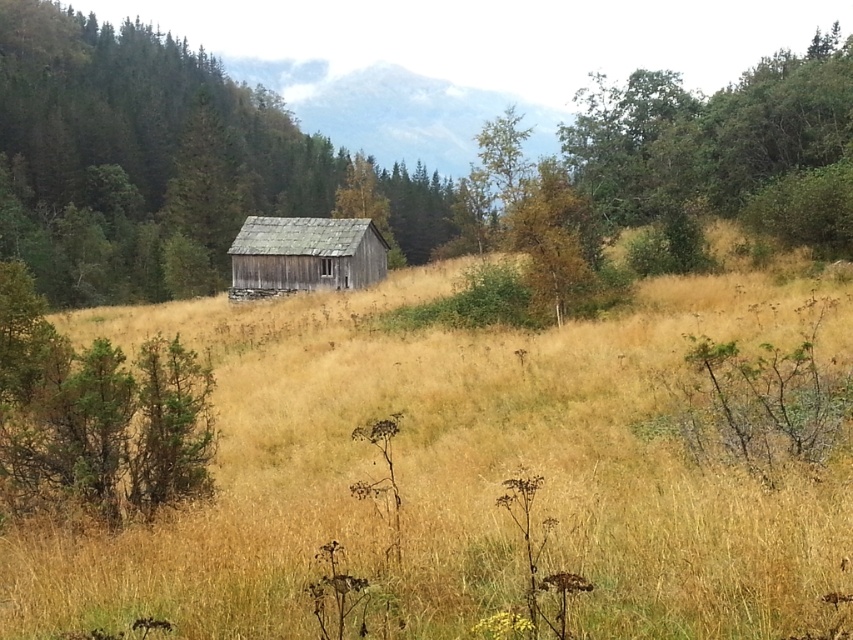
Question: Can you confirm if green textured tree at center is wider than weathered wood hut at center?

Choices:
 (A) yes
 (B) no

Answer: (A)

Question: Among these objects, which one is farthest from the camera?

Choices:
 (A) weathered wood hut at center
 (B) green textured tree at center

Answer: (B)

Question: Observing the image, what is the correct spatial positioning of green textured tree at center in reference to weathered wood hut at center?

Choices:
 (A) left
 (B) right

Answer: (A)

Question: Which object appears farthest from the camera in this image?

Choices:
 (A) green textured tree at center
 (B) weathered wood hut at center

Answer: (A)

Question: Does green textured tree at center appear on the left side of weathered wood hut at center?

Choices:
 (A) no
 (B) yes

Answer: (B)

Question: Which of the following is the closest to the observer?

Choices:
 (A) (373, 241)
 (B) (194, 54)

Answer: (A)